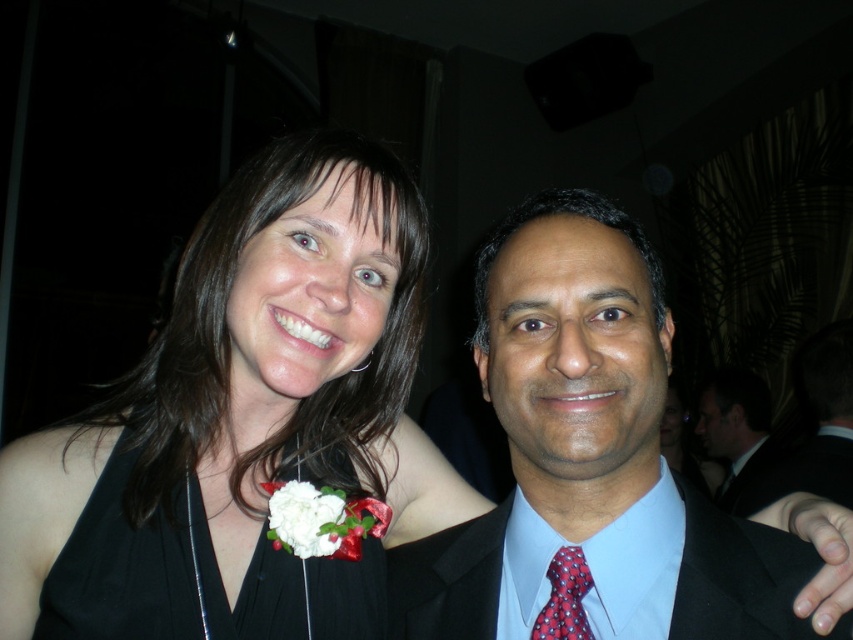
Between matte black suit at right and white fabric flower at center, which one is positioned lower?

matte black suit at right is below.

Does point (730, 380) lie in front of point (306, 500)?

No, (730, 380) is further to viewer.

The height and width of the screenshot is (640, 853). Identify the location of matte black suit at right. (735, 428).

Can you confirm if light blue satin shirt at center is positioned below red dotted tie at center?

Actually, light blue satin shirt at center is above red dotted tie at center.

Measure the distance from light blue satin shirt at center to red dotted tie at center.

They are 4.71 inches apart.

Image resolution: width=853 pixels, height=640 pixels. What are the coordinates of `light blue satin shirt at center` in the screenshot? It's located at (587, 452).

Can you confirm if black satin dress at center is taller than white fabric flower at center?

Correct, black satin dress at center is much taller as white fabric flower at center.

Can you confirm if black satin dress at center is positioned below white fabric flower at center?

No, black satin dress at center is not below white fabric flower at center.

Image resolution: width=853 pixels, height=640 pixels. Describe the element at coordinates (242, 422) in the screenshot. I see `black satin dress at center` at that location.

Where is `black satin dress at center`? Image resolution: width=853 pixels, height=640 pixels. black satin dress at center is located at coordinates (242, 422).